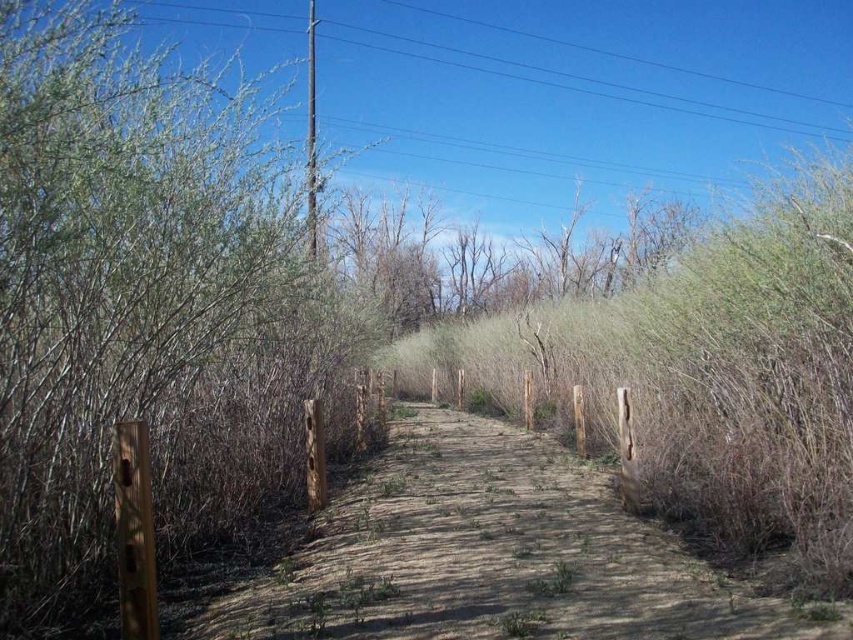
Question: Where is green leafy bush at left located in relation to brown dirt path at center in the image?

Choices:
 (A) left
 (B) right

Answer: (A)

Question: Is green leafy bush at left positioned behind bare branches at center?

Choices:
 (A) yes
 (B) no

Answer: (B)

Question: Among these objects, which one is nearest to the camera?

Choices:
 (A) green leafy bush at left
 (B) bare branches at center

Answer: (A)

Question: Does green leafy bush at left have a smaller size compared to brown dirt path at center?

Choices:
 (A) no
 (B) yes

Answer: (A)

Question: Which of the following is the closest to the observer?

Choices:
 (A) bare branches at center
 (B) green leafy bush at left

Answer: (B)

Question: Estimate the real-world distances between objects in this image. Which object is farther from the bare branches at center?

Choices:
 (A) green leafy bush at left
 (B) brown dirt path at center

Answer: (B)